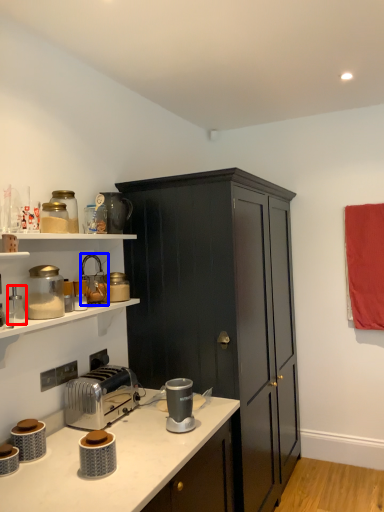
Question: Which point is closer to the camera, appliance (highlighted by a red box) or appliance (highlighted by a blue box)?

Choices:
 (A) appliance
 (B) appliance

Answer: (A)